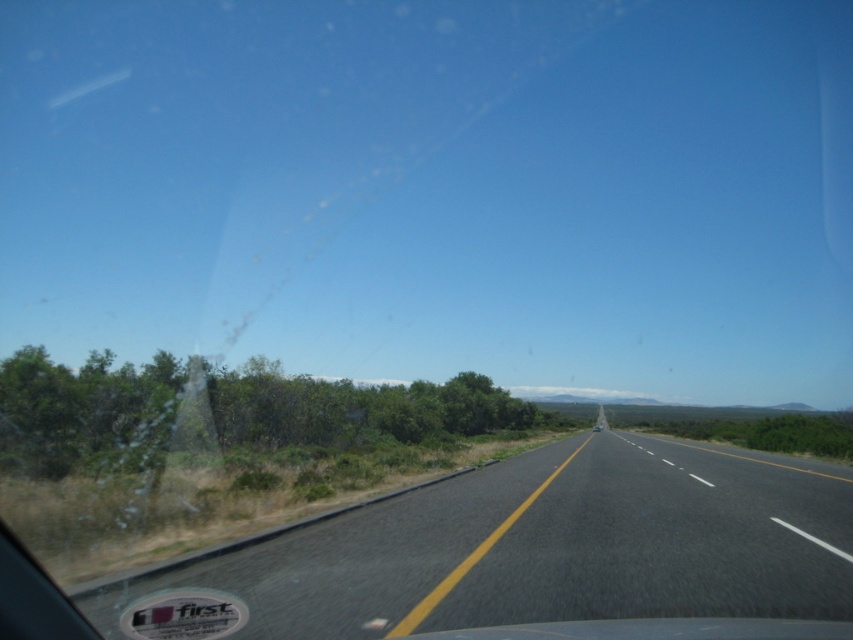
Question: Among these objects, which one is farthest from the camera?

Choices:
 (A) green leafy shrub at left
 (B) black asphalt road at center

Answer: (A)

Question: Which object is closer to the camera taking this photo?

Choices:
 (A) green leafy shrub at left
 (B) black asphalt road at center

Answer: (B)

Question: Can you confirm if black asphalt road at center is positioned below green leafy shrub at left?

Choices:
 (A) no
 (B) yes

Answer: (A)

Question: Does black asphalt road at center appear on the right side of green leafy shrub at left?

Choices:
 (A) yes
 (B) no

Answer: (A)

Question: Can you confirm if black asphalt road at center is smaller than green leafy shrub at left?

Choices:
 (A) yes
 (B) no

Answer: (A)